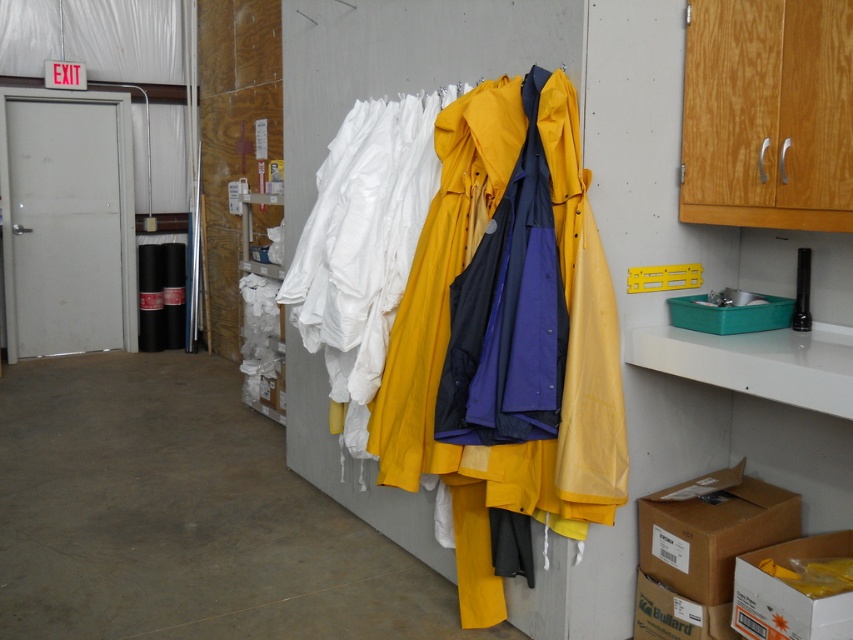
You are a delivery person who needs to stack a new box on top of the existing boxes in the storage area. The new box is 10 inches tall. You see the brown cardboard box at lower right and the white cardboard box at lower right. Which box can the new box fit on top of without exceeding the height limit?

The new box can be placed on top of the brown cardboard box at lower right since it is taller than the white cardboard box at lower right, providing a stable base for the new box.

You are an employee in the workshop and need to retrieve the brown cardboard box at lower right. Can you reach it without moving the yellow matte raincoat at center?

The yellow matte raincoat at center is positioned over the brown cardboard box at lower right, so you cannot reach the box without moving the raincoat.